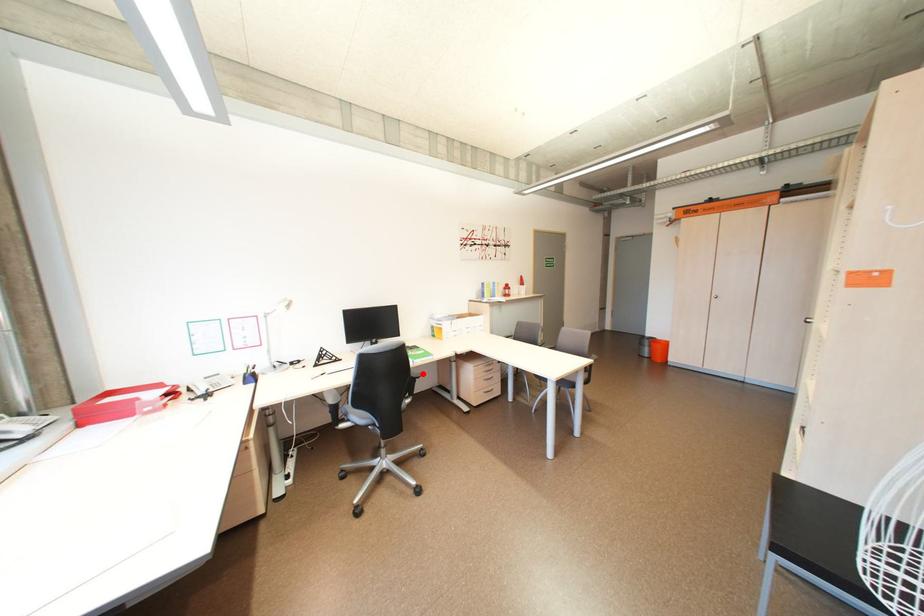
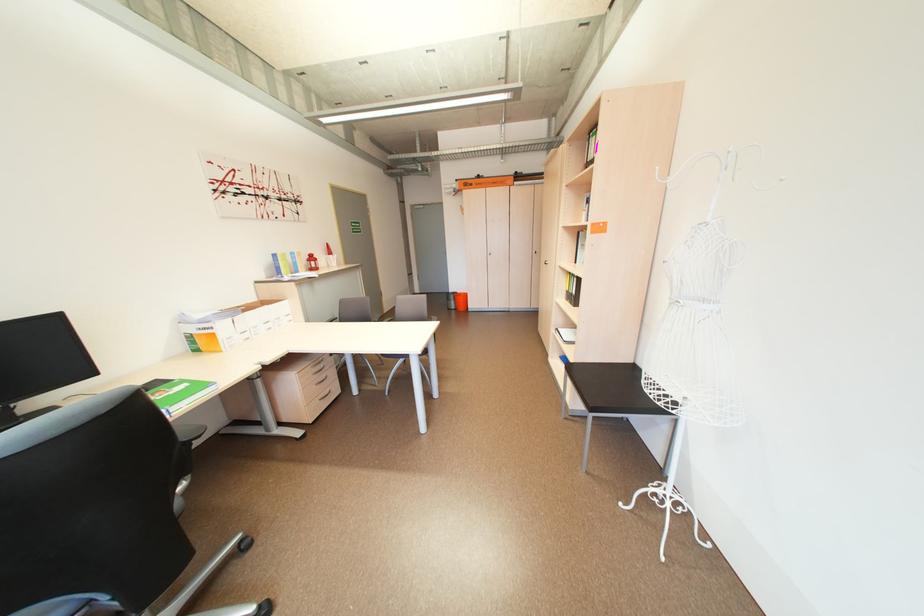
Locate, in the second image, the point that corresponds to the highlighted location in the first image.

(193, 436)